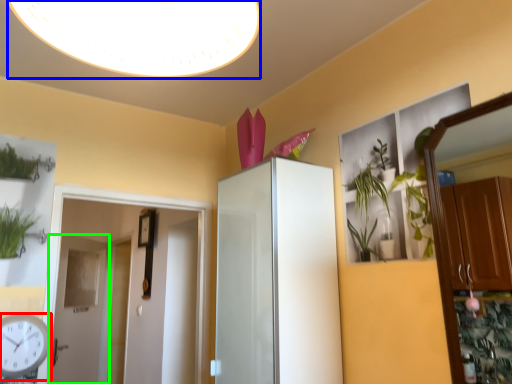
Question: Estimate the real-world distances between objects in this image. Which object is farther from clock (highlighted by a red box), light fixture (highlighted by a blue box) or door (highlighted by a green box)?

Choices:
 (A) light fixture
 (B) door

Answer: (B)